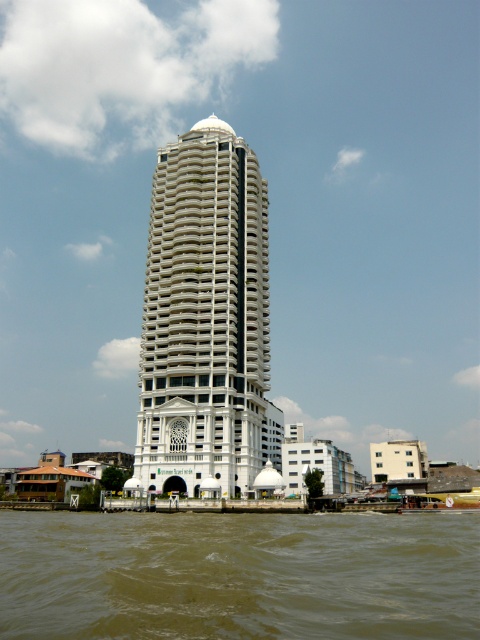
You are standing on the waterfront near the white skyscraper and want to check the water quality of the brown muddy water at lower center. If your water testing kit has a maximum reach of 20 meters, can you test it without moving closer?

The brown muddy water at lower center is 19.08 meters away from the viewer. Since the testing kit can reach up to 20 meters, you can test it without moving closer.

You are standing at the waterfront looking at the skyscraper. There are two points marked on the building. The first point is at coordinates point (204, 525) and the second point is at point (315, 452). Which point is closer to your current position?

Point (204, 525) is closer to the camera than point (315, 452), so the first point is closer to your current position.

You are a photographer standing on the waterfront and want to capture both the white glossy building at center and the white matte building at lower right in a single shot. Based on their positions, which building will appear closer to the camera in the photo?

The white glossy building at center will appear closer to the camera in the photo because it is positioned over the white matte building at lower right, indicating it is in front.